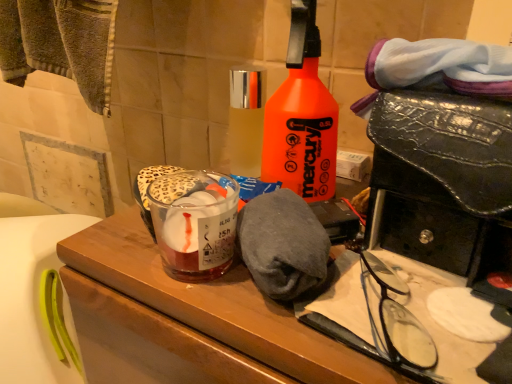
Question: In which direction should I rotate to look at clear glass bottle at center, acting as the second bottle starting from the right?

Choices:
 (A) right
 (B) left

Answer: (B)

Question: Does clear glass bottle at center, acting as the 1th bottle starting from the left, have a smaller size compared to black plastic glasses at lower right?

Choices:
 (A) yes
 (B) no

Answer: (B)

Question: Is clear glass bottle at center, acting as the 1th bottle starting from the left, closer to camera compared to black plastic glasses at lower right?

Choices:
 (A) no
 (B) yes

Answer: (A)

Question: Does clear glass bottle at center, acting as the 1th bottle starting from the left, have a lesser height compared to black plastic glasses at lower right?

Choices:
 (A) no
 (B) yes

Answer: (A)

Question: Is clear glass bottle at center, acting as the second bottle starting from the right, directly adjacent to black plastic glasses at lower right?

Choices:
 (A) no
 (B) yes

Answer: (A)

Question: Can you confirm if clear glass bottle at center, acting as the 1th bottle starting from the left, is positioned to the left of black plastic glasses at lower right?

Choices:
 (A) yes
 (B) no

Answer: (A)

Question: Is clear glass bottle at center, acting as the 1th bottle starting from the left, oriented towards black plastic glasses at lower right?

Choices:
 (A) no
 (B) yes

Answer: (A)

Question: Is translucent glass at center at the left side of black plastic glasses at lower right?

Choices:
 (A) no
 (B) yes

Answer: (B)

Question: Can you confirm if translucent glass at center is shorter than black plastic glasses at lower right?

Choices:
 (A) no
 (B) yes

Answer: (A)

Question: Is translucent glass at center far away from black plastic glasses at lower right?

Choices:
 (A) no
 (B) yes

Answer: (A)

Question: Is black plastic glasses at lower right at the back of translucent glass at center?

Choices:
 (A) yes
 (B) no

Answer: (B)

Question: Considering the relative sizes of translucent glass at center and black plastic glasses at lower right in the image provided, is translucent glass at center bigger than black plastic glasses at lower right?

Choices:
 (A) no
 (B) yes

Answer: (B)

Question: Can you confirm if translucent glass at center is positioned to the right of black plastic glasses at lower right?

Choices:
 (A) yes
 (B) no

Answer: (B)

Question: Does orange matte spray bottle at center, arranged as the second bottle when viewed from the left, have a larger size compared to clear glass bottle at center, acting as the second bottle starting from the right?

Choices:
 (A) yes
 (B) no

Answer: (A)